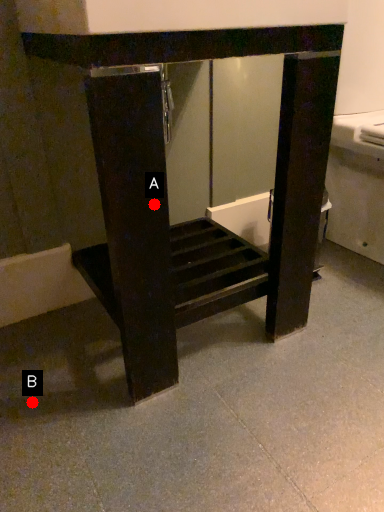
Question: Two points are circled on the image, labeled by A and B beside each circle. Which point is closer to the camera?

Choices:
 (A) A is closer
 (B) B is closer

Answer: (A)